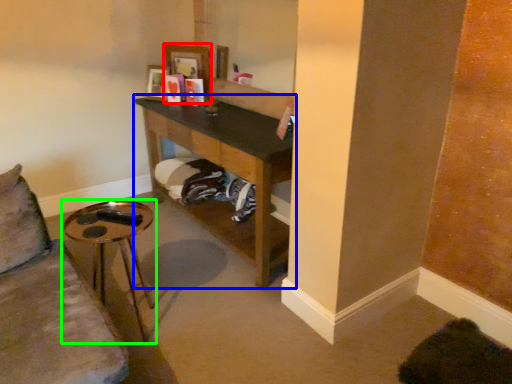
Question: Considering the real-world distances, which object is closest to picture frame (highlighted by a red box)? shelf (highlighted by a blue box) or table (highlighted by a green box).

Choices:
 (A) shelf
 (B) table

Answer: (A)